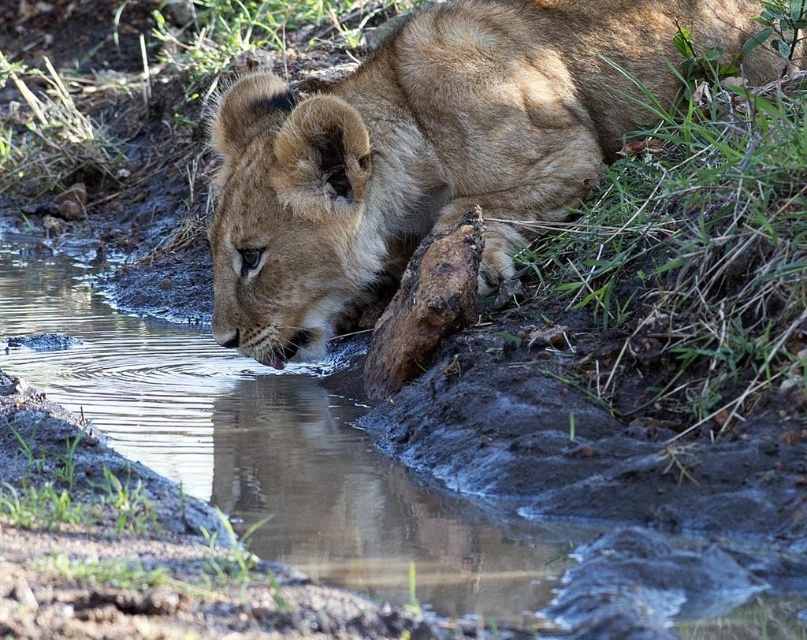
Question: Among these objects, which one is nearest to the camera?

Choices:
 (A) brown muddy stream at lower left
 (B) golden fur lion at center

Answer: (A)

Question: Can you confirm if golden fur lion at center is bigger than brown muddy stream at lower left?

Choices:
 (A) no
 (B) yes

Answer: (A)

Question: Which object appears farthest from the camera in this image?

Choices:
 (A) golden fur lion at center
 (B) brown muddy stream at lower left

Answer: (A)

Question: Can you confirm if golden fur lion at center is positioned below brown muddy stream at lower left?

Choices:
 (A) no
 (B) yes

Answer: (A)

Question: Which object is closer to the camera taking this photo?

Choices:
 (A) golden fur lion at center
 (B) brown muddy stream at lower left

Answer: (B)

Question: Is golden fur lion at center above brown muddy stream at lower left?

Choices:
 (A) yes
 (B) no

Answer: (A)